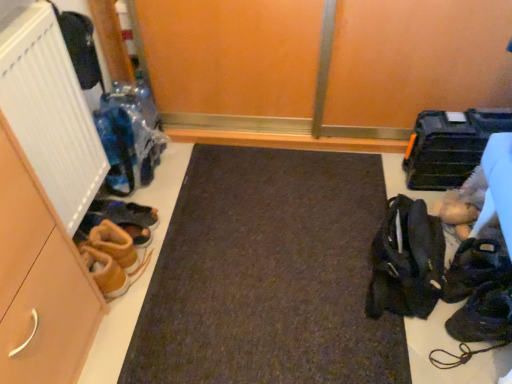
Question: Does brown suede shoes at left, arranged as the 2th footwear when viewed from the left, have a greater height compared to black leather shoes at lower right, the first footwear viewed from the right?

Choices:
 (A) no
 (B) yes

Answer: (A)

Question: Considering the relative sizes of brown suede shoes at left, arranged as the 2th footwear when viewed from the left, and black leather shoes at lower right, the 4th footwear viewed from the left, in the image provided, is brown suede shoes at left, arranged as the 2th footwear when viewed from the left, bigger than black leather shoes at lower right, the 4th footwear viewed from the left,?

Choices:
 (A) no
 (B) yes

Answer: (A)

Question: Does brown suede shoes at left, arranged as the 2th footwear when viewed from the left, lie behind black leather shoes at lower right, the 4th footwear viewed from the left?

Choices:
 (A) yes
 (B) no

Answer: (A)

Question: Considering the relative sizes of brown suede shoes at left, arranged as the 2th footwear when viewed from the left, and black leather shoes at lower right, the first footwear viewed from the right, in the image provided, is brown suede shoes at left, arranged as the 2th footwear when viewed from the left, thinner than black leather shoes at lower right, the first footwear viewed from the right,?

Choices:
 (A) no
 (B) yes

Answer: (B)

Question: Does brown suede shoes at left, the third footwear viewed from the right, have a greater width compared to black leather shoes at lower right, the first footwear viewed from the right?

Choices:
 (A) no
 (B) yes

Answer: (A)

Question: From a real-world perspective, is brown suede shoes at left, arranged as the 2th footwear when viewed from the left, on black leather shoes at lower right, the 4th footwear viewed from the left?

Choices:
 (A) no
 (B) yes

Answer: (A)

Question: Is the depth of black leather shoes at lower right, the first footwear viewed from the right, greater than that of matte brown cabinet at left?

Choices:
 (A) no
 (B) yes

Answer: (B)

Question: Is the depth of black leather shoes at lower right, the 4th footwear viewed from the left, less than that of matte brown cabinet at left?

Choices:
 (A) no
 (B) yes

Answer: (A)

Question: Would you say matte brown cabinet at left is part of black leather shoes at lower right, the 4th footwear viewed from the left,'s contents?

Choices:
 (A) no
 (B) yes

Answer: (A)

Question: Is black leather shoes at lower right, the first footwear viewed from the right, taller than matte brown cabinet at left?

Choices:
 (A) yes
 (B) no

Answer: (B)

Question: Is black leather shoes at lower right, the first footwear viewed from the right, facing away from matte brown cabinet at left?

Choices:
 (A) no
 (B) yes

Answer: (A)

Question: Is black leather shoes at lower right, the 4th footwear viewed from the left, smaller than matte brown cabinet at left?

Choices:
 (A) yes
 (B) no

Answer: (A)

Question: Is black fabric bag at right taller than white ribbed radiator at left?

Choices:
 (A) yes
 (B) no

Answer: (B)